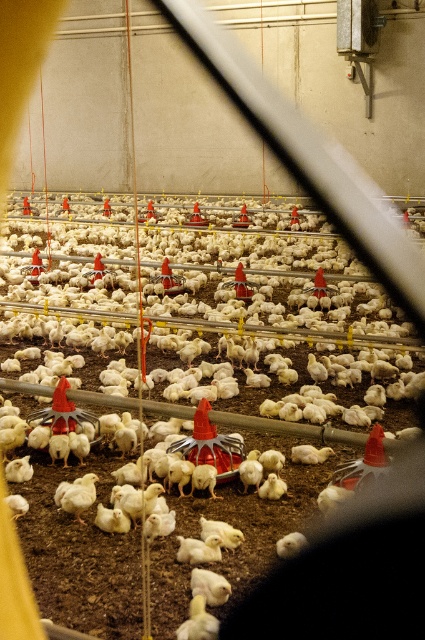
Question: Which of the following is the closest to the observer?

Choices:
 (A) white fluffy chicken at center
 (B) white matte chicken at center

Answer: (A)

Question: Which object is closer to the camera taking this photo?

Choices:
 (A) white fluffy chicken at center
 (B) white matte chicken at center

Answer: (A)

Question: Where is white matte chicken at center located in relation to white fluffy chicken at center in the image?

Choices:
 (A) right
 (B) left

Answer: (A)

Question: Which point appears farthest from the camera in this image?

Choices:
 (A) (119, 240)
 (B) (291, 534)

Answer: (A)

Question: Does white matte chicken at center have a lesser width compared to white fluffy chicken at center?

Choices:
 (A) yes
 (B) no

Answer: (B)

Question: Does white matte chicken at center appear under white fluffy chicken at center?

Choices:
 (A) no
 (B) yes

Answer: (A)